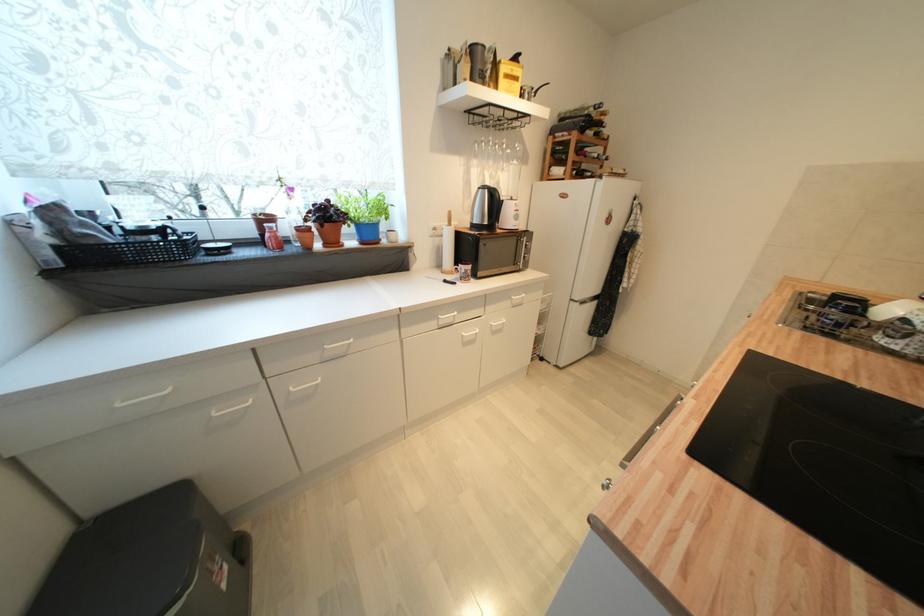
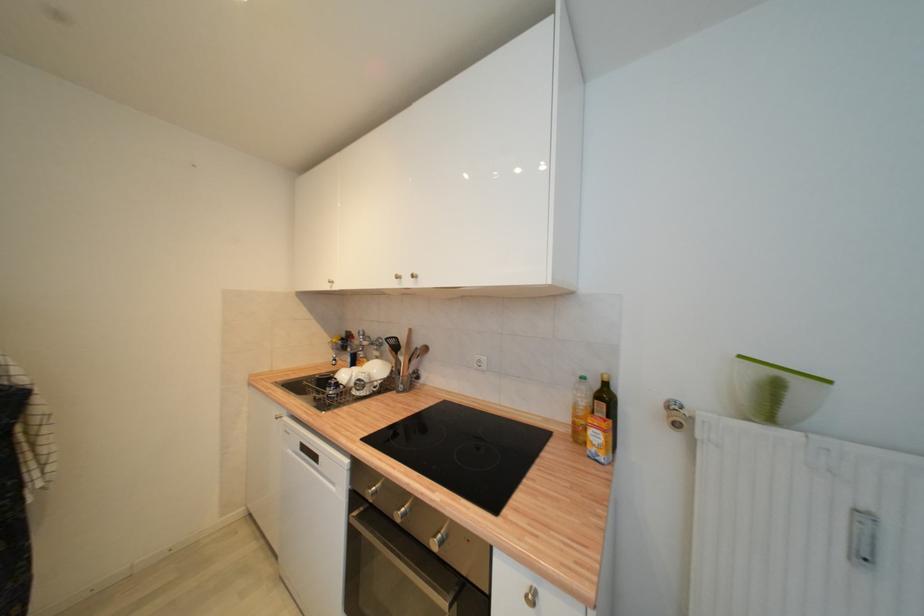
Question: The first image is from the beginning of the video and the second image is from the end. How did the camera likely rotate when shooting the video?

Choices:
 (A) Left
 (B) Right
 (C) Up
 (D) Down

Answer: (B)